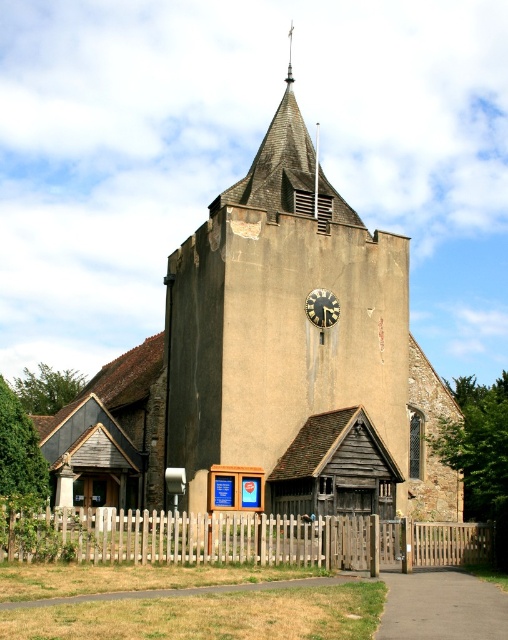
Question: Is brown stone church at center further to the viewer compared to white wooden fence at lower center?

Choices:
 (A) yes
 (B) no

Answer: (A)

Question: Does brown stone church at center appear over black metal clock at center?

Choices:
 (A) no
 (B) yes

Answer: (B)

Question: Does brown stone church at center appear under white wooden fence at lower center?

Choices:
 (A) yes
 (B) no

Answer: (B)

Question: Which is nearer to the black metal clock at center?

Choices:
 (A) brown stone church at center
 (B) white wooden fence at lower center

Answer: (A)

Question: Which is farther from the black metal clock at center?

Choices:
 (A) brown stone church at center
 (B) white wooden fence at lower center

Answer: (B)

Question: Which of the following is the closest to the observer?

Choices:
 (A) (374, 572)
 (B) (319, 404)

Answer: (A)